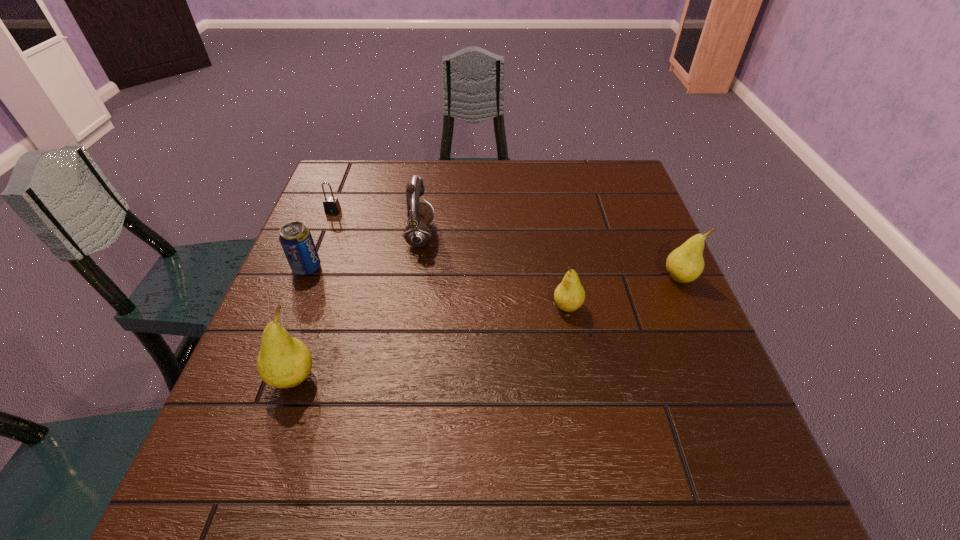
At what (x,y) coordinates should I click in order to perform the action: click on object identified as the fifth closest to the rightmost pear. Please return your answer as a coordinate pair (x, y). The height and width of the screenshot is (540, 960). Looking at the image, I should click on (331, 204).

The image size is (960, 540). In order to click on pear that is the second closest to the padlock in this screenshot , I will do `click(569, 295)`.

This screenshot has width=960, height=540. I want to click on the closest pear to the second pear from right to left, so click(x=684, y=264).

I want to click on free location that satisfies the following two spatial constraints: 1. on the shackle of the padlock; 2. on the right side of the shortest pear, so click(x=295, y=308).

The image size is (960, 540). I want to click on vacant position in the image that satisfies the following two spatial constraints: 1. on the ear pads of the fifth farthest object; 2. on the left side of the earphone, so click(x=409, y=308).

The width and height of the screenshot is (960, 540). Find the location of `vacant position in the image that satisfies the following two spatial constraints: 1. on the shackle of the shortest object; 2. on the left side of the rightmost pear`. vacant position in the image that satisfies the following two spatial constraints: 1. on the shackle of the shortest object; 2. on the left side of the rightmost pear is located at coordinates click(x=306, y=279).